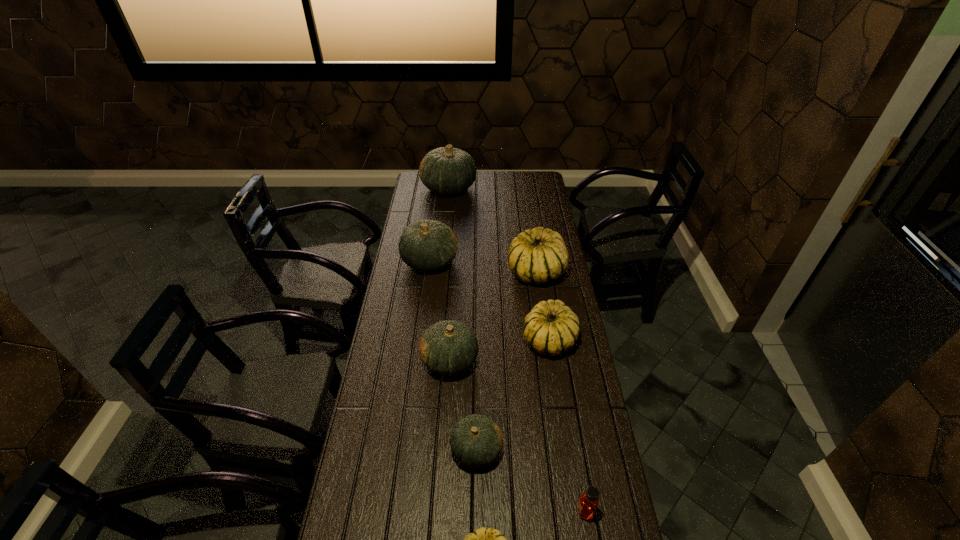
This screenshot has height=540, width=960. Find the location of `vacant region located 0.120m on the back of the third smallest orange gourd`. vacant region located 0.120m on the back of the third smallest orange gourd is located at coordinates (434, 228).

Identify the location of vacant space located 0.280m on the left of the biggest white gourd. (444, 272).

Locate an element on the screen. vacant space located 0.340m on the front of the second nearest orange gourd is located at coordinates (442, 482).

Image resolution: width=960 pixels, height=540 pixels. I want to click on vacant space located on the front of the second smallest white gourd, so click(567, 456).

The width and height of the screenshot is (960, 540). I want to click on free location located 0.110m on the front of the third nearest object, so click(x=476, y=513).

This screenshot has width=960, height=540. What are the coordinates of `free region located 0.160m on the front label of the honey` in the screenshot? It's located at (518, 510).

This screenshot has height=540, width=960. In order to click on free location located 0.340m on the front label of the honey in this screenshot , I will do `click(454, 510)`.

Where is `free space located on the front label of the honey`? The width and height of the screenshot is (960, 540). free space located on the front label of the honey is located at coordinates (441, 510).

Locate an element on the screen. Image resolution: width=960 pixels, height=540 pixels. object at the far edge is located at coordinates (446, 170).

In order to click on honey present at the right edge in this screenshot , I will do `click(588, 502)`.